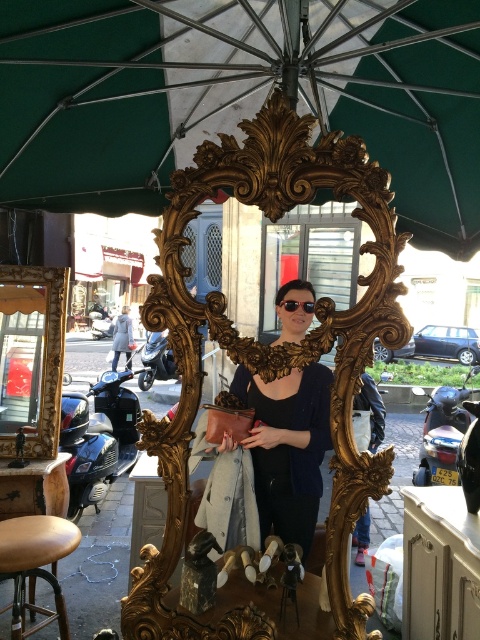
Image resolution: width=480 pixels, height=640 pixels. What are the coordinates of `gold ornate mirror at center` in the screenshot? It's located at (267, 360).

Is point (271, 172) positioned before point (315, 410)?

Yes, point (271, 172) is closer to viewer.

The height and width of the screenshot is (640, 480). In order to click on gold ornate mirror at center in this screenshot , I will do `click(267, 360)`.

Does green fabric umbrella at upper center appear under matte black sunglasses at center?

Actually, green fabric umbrella at upper center is above matte black sunglasses at center.

Who is lower down, green fabric umbrella at upper center or matte black sunglasses at center?

matte black sunglasses at center

Who is more distant from viewer, (x=43, y=140) or (x=273, y=528)?

Positioned behind is point (x=43, y=140).

Identify the location of green fabric umbrella at upper center. This screenshot has height=640, width=480. (238, 97).

Is matte black sunglasses at center positioned in front of brown leather stool at lower left?

Yes, it is in front of brown leather stool at lower left.

Can you confirm if matte black sunglasses at center is positioned below brown leather stool at lower left?

Incorrect, matte black sunglasses at center is not positioned below brown leather stool at lower left.

Image resolution: width=480 pixels, height=640 pixels. What do you see at coordinates (288, 448) in the screenshot?
I see `matte black sunglasses at center` at bounding box center [288, 448].

At what (x,y) coordinates should I click in order to perform the action: click on matte black sunglasses at center. Please return your answer as a coordinate pair (x, y). Looking at the image, I should click on (288, 448).